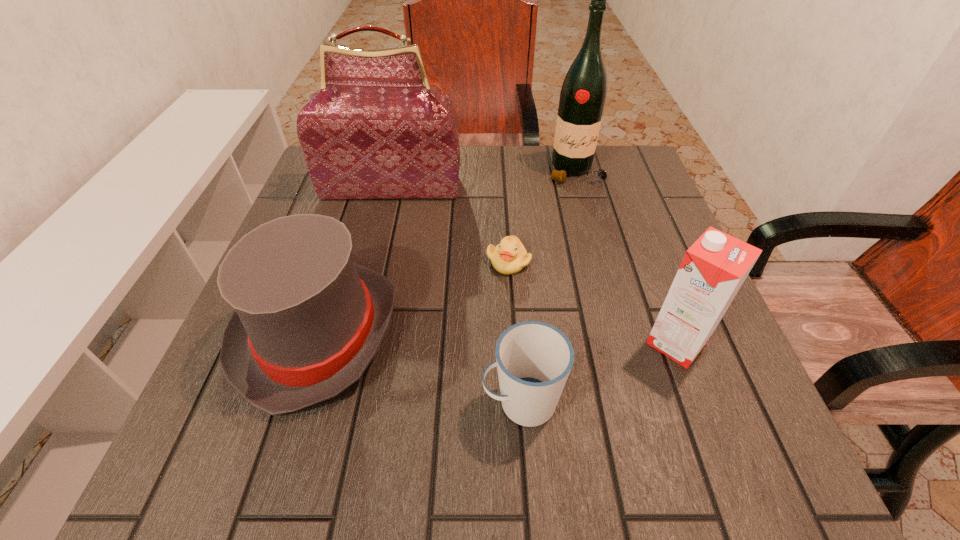
You are a GUI agent. You are given a task and a screenshot of the screen. Output one action in this format:
    pyautogui.click(x=<x>, y=<y>)
    Task: Click on the vacant space located with a handle on the side of the fifth tallest object
    The height and width of the screenshot is (540, 960).
    Given the screenshot: What is the action you would take?
    pyautogui.click(x=386, y=402)

Find the location of a particular element. This screenshot has height=540, width=960. vacant space located 0.210m with a handle on the side of the fifth tallest object is located at coordinates (348, 402).

Find the location of `vacant area located with a handle on the side of the fifth tallest object`. vacant area located with a handle on the side of the fifth tallest object is located at coordinates (342, 402).

You are a GUI agent. You are given a task and a screenshot of the screen. Output one action in this format:
    pyautogui.click(x=<x>, y=<y>)
    Task: Click on the vacant space located at the face of the shortest object
    This screenshot has width=960, height=540.
    Given the screenshot: What is the action you would take?
    pyautogui.click(x=511, y=299)

Where is `wine bottle located at the far edge`? wine bottle located at the far edge is located at coordinates (582, 98).

The image size is (960, 540). Find the location of `handbag that is positioned at the far edge`. handbag that is positioned at the far edge is located at coordinates pyautogui.click(x=376, y=130).

This screenshot has width=960, height=540. What are the coordinates of `object that is positioned at the near edge` in the screenshot? It's located at (534, 359).

In order to click on handbag at the left edge in this screenshot , I will do `click(376, 130)`.

I want to click on dress hat located at the left edge, so click(307, 322).

Where is `wine bottle that is at the right edge`? The height and width of the screenshot is (540, 960). wine bottle that is at the right edge is located at coordinates (582, 98).